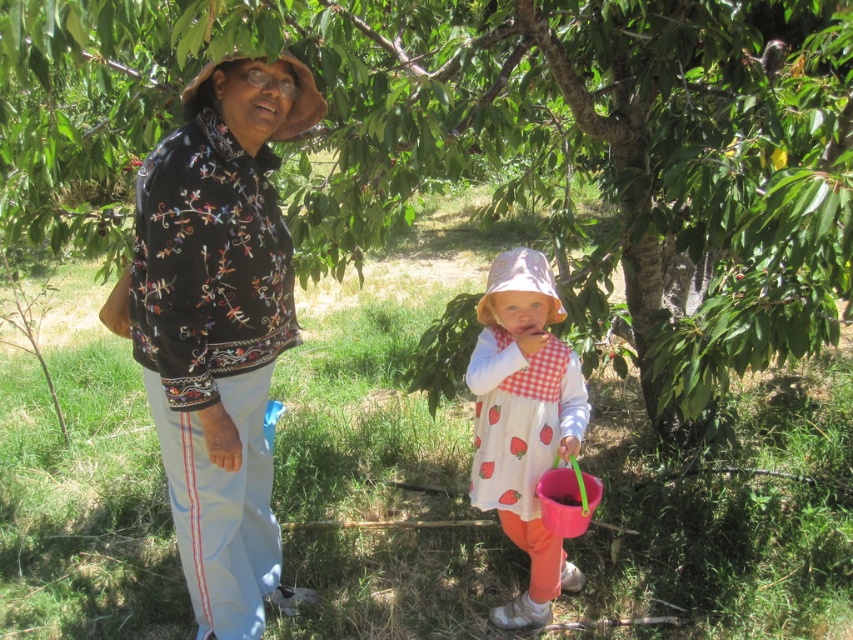
You are planning to hang a bird feeder from the green leafy tree at center. The embroidered cotton jacket at center is directly beneath it. Will the bird feeder hang above the jacket?

Yes, the green leafy tree at center is located above the embroidered cotton jacket at center, so the bird feeder will hang above the jacket.

From the picture: You are standing at the center of the garden. Where is the green leafy tree at center located in terms of coordinates?

The green leafy tree at center is located at coordinates point (x=495, y=147).